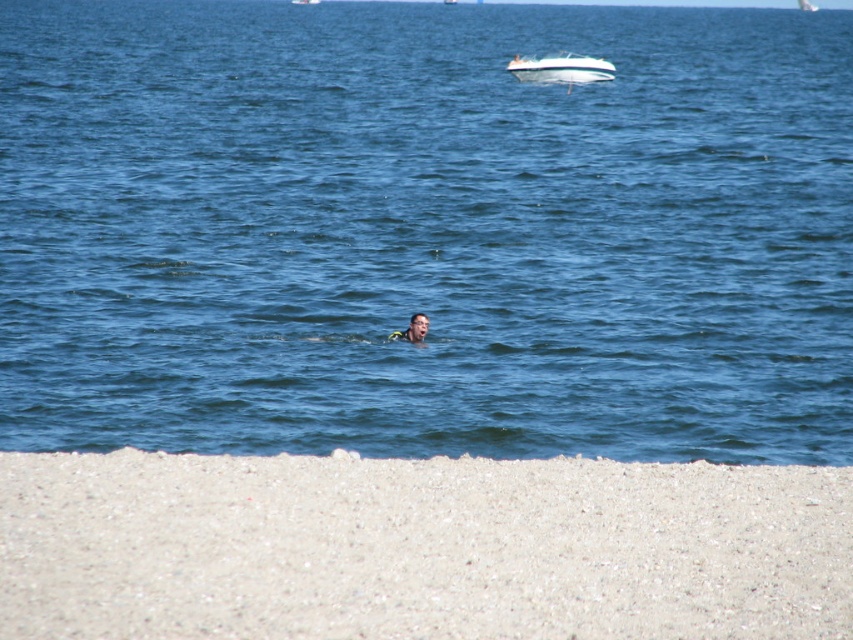
Does fine sand beach at lower center appear over smooth skin face at center?

No.

Can you confirm if fine sand beach at lower center is positioned below smooth skin face at center?

Yes.

Between point (293, 544) and point (405, 339), which one is positioned behind?

The point (405, 339) is behind.

The image size is (853, 640). I want to click on fine sand beach at lower center, so click(x=419, y=547).

Is blue water at center closer to camera compared to fine sand beach at lower center?

No, it is behind fine sand beach at lower center.

Which is in front, point (634, 177) or point (265, 593)?

Point (265, 593)

Image resolution: width=853 pixels, height=640 pixels. I want to click on blue water at center, so click(x=425, y=230).

Does fine sand beach at lower center have a larger size compared to white glossy boat at upper center?

No.

Is point (148, 506) in front of point (525, 80)?

That is True.

Locate an element on the screen. Image resolution: width=853 pixels, height=640 pixels. fine sand beach at lower center is located at coordinates (419, 547).